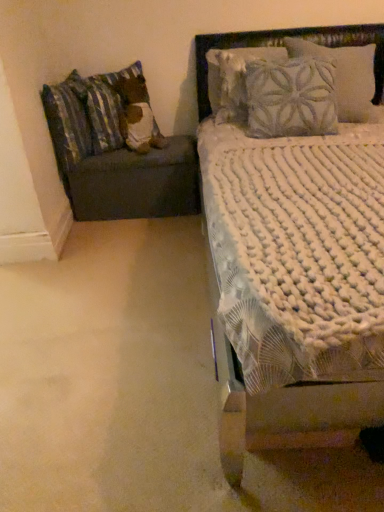
Where is `vacant space to the right of fluffy fabric pillow at left, which is counted as the second pillow, starting from the left`? The height and width of the screenshot is (512, 384). vacant space to the right of fluffy fabric pillow at left, which is counted as the second pillow, starting from the left is located at coordinates (177, 143).